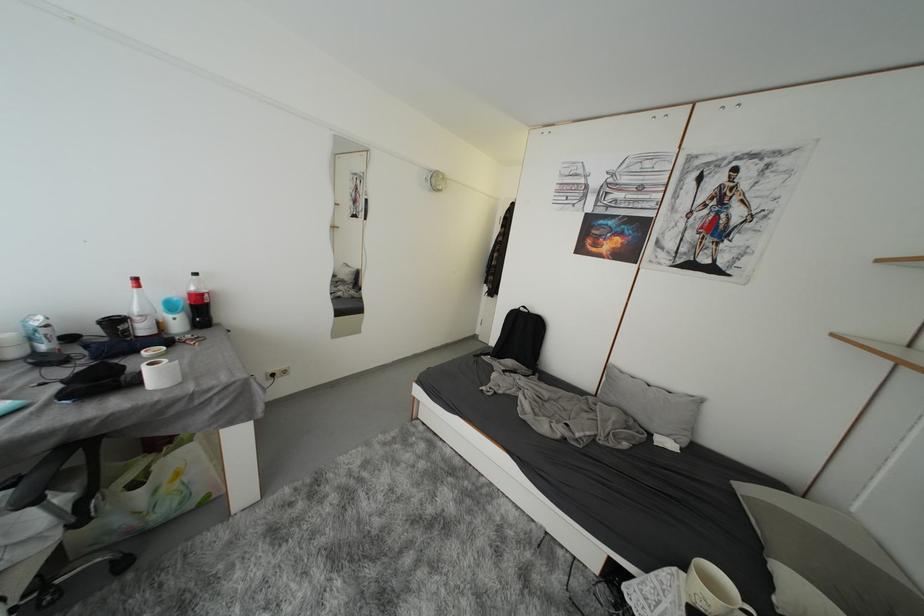
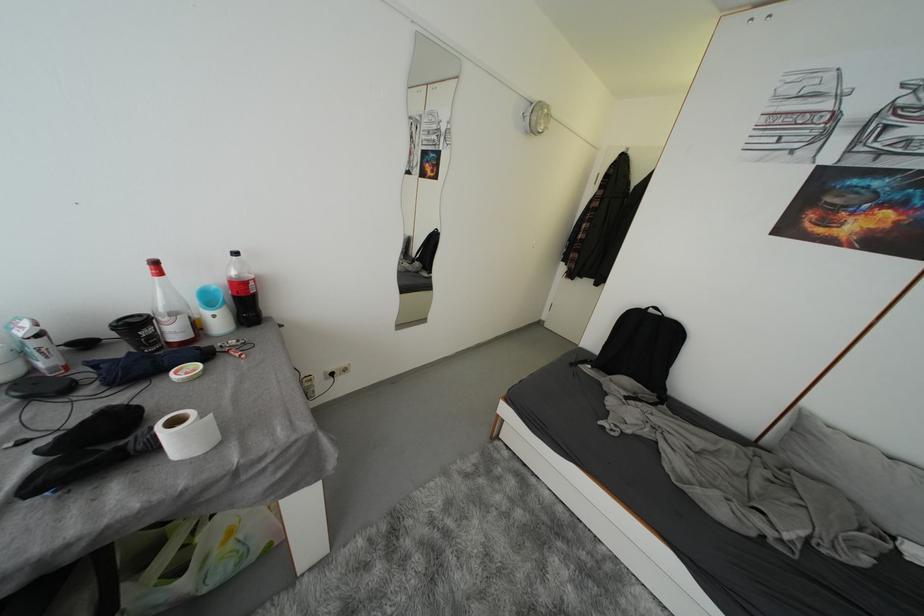
Locate, in the second image, the point that corresponds to pixel 142 284 in the first image.

(162, 267)